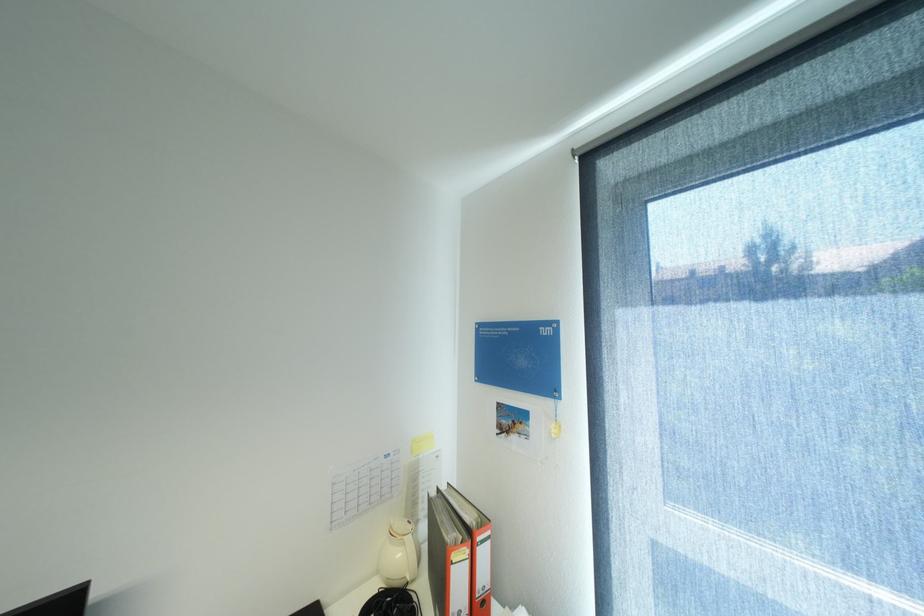
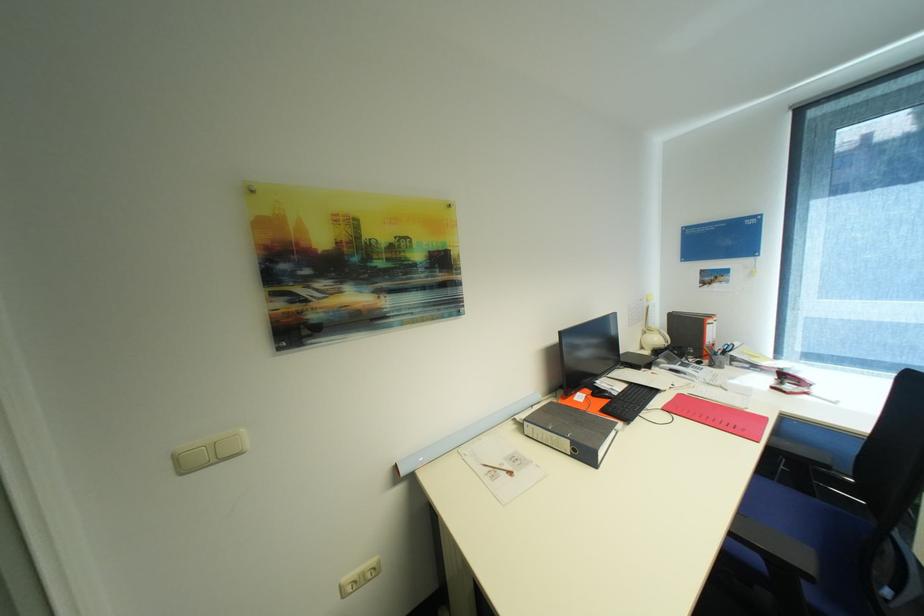
Find the pixel in the second image that matches the point at 407,554 in the first image.

(663, 339)